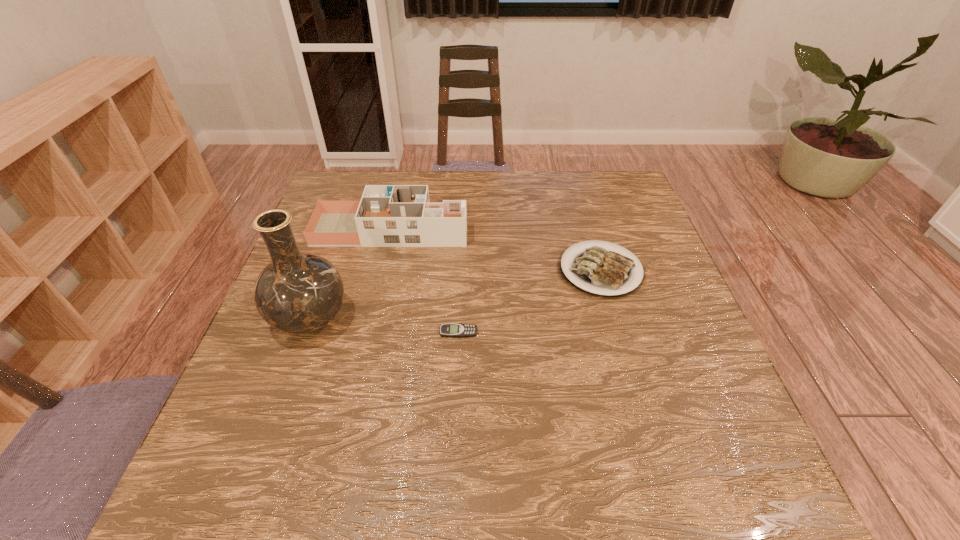
Identify the location of blank region between the beeper and the vase. (385, 326).

At what (x,y) coordinates should I click in order to perform the action: click on vacant space that's between the shortest object and the tallest object. Please return your answer as a coordinate pair (x, y). Looking at the image, I should click on (385, 326).

Locate an element on the screen. free spot between the tallest object and the third shortest object is located at coordinates (351, 274).

Identify the location of vacant point located between the tallest object and the third shortest object. The width and height of the screenshot is (960, 540). (351, 274).

Where is `vacant area between the plate and the shortest object`? The height and width of the screenshot is (540, 960). vacant area between the plate and the shortest object is located at coordinates (530, 301).

This screenshot has width=960, height=540. I want to click on vacant point located between the rightmost object and the tallest object, so click(456, 295).

The width and height of the screenshot is (960, 540). In order to click on free space between the beeper and the rightmost object in this screenshot , I will do `click(530, 301)`.

You are a GUI agent. You are given a task and a screenshot of the screen. Output one action in this format:
    pyautogui.click(x=<x>, y=<y>)
    Task: Click on the blank region between the plate and the vase
    This screenshot has width=960, height=540.
    Given the screenshot: What is the action you would take?
    pyautogui.click(x=456, y=295)

Locate an element on the screen. The width and height of the screenshot is (960, 540). vacant region between the tallest object and the second tallest object is located at coordinates (351, 274).

Where is `vacant area that lies between the tallest object and the shortest object`? This screenshot has height=540, width=960. vacant area that lies between the tallest object and the shortest object is located at coordinates (385, 326).